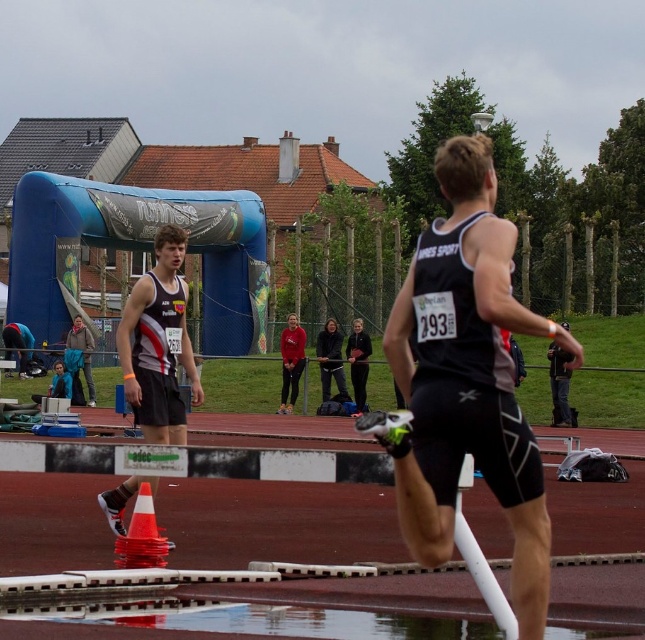
Question: Does matte black singlet at center come behind dark gray fabric jacket at right?

Choices:
 (A) yes
 (B) no

Answer: (B)

Question: Which object is the closest to the matte black singlet at center?

Choices:
 (A) black matte singlet at center
 (B) matte black tank top at center
 (C) dark gray fabric jacket at right

Answer: (A)

Question: Which of the following is the closest to the observer?

Choices:
 (A) matte black tank top at center
 (B) dark gray fabric jacket at right

Answer: (B)

Question: Where is black matte singlet at center located in relation to matte red hoodie at center in the image?

Choices:
 (A) right
 (B) left

Answer: (A)

Question: Which object appears closest to the camera in this image?

Choices:
 (A) dark gray fabric jacket at right
 (B) orange/transparent plastic cone at lower center
 (C) matte black singlet at center

Answer: (C)

Question: Does matte red hoodie at center have a lesser width compared to dark gray fabric jacket at right?

Choices:
 (A) no
 (B) yes

Answer: (B)